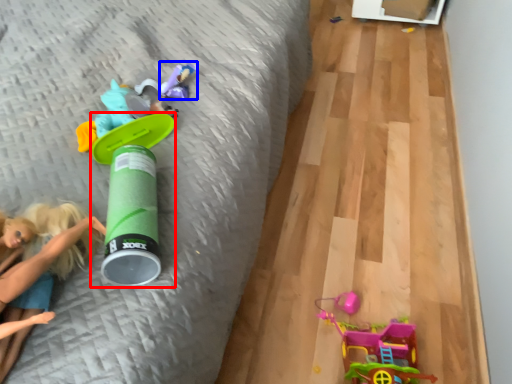
Question: Which point is further to the camera, toy (highlighted by a red box) or toy (highlighted by a blue box)?

Choices:
 (A) toy
 (B) toy

Answer: (B)